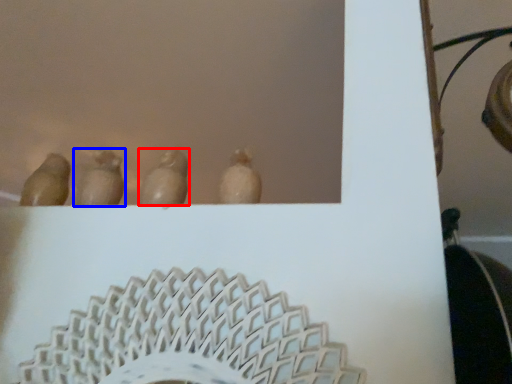
Question: Which point is closer to the camera, animal (highlighted by a red box) or animal (highlighted by a blue box)?

Choices:
 (A) animal
 (B) animal

Answer: (A)